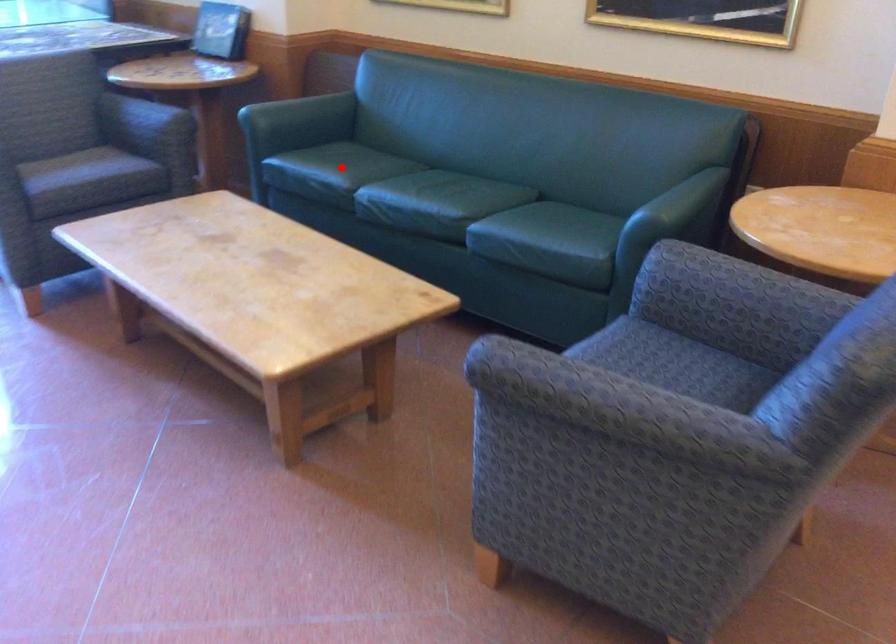
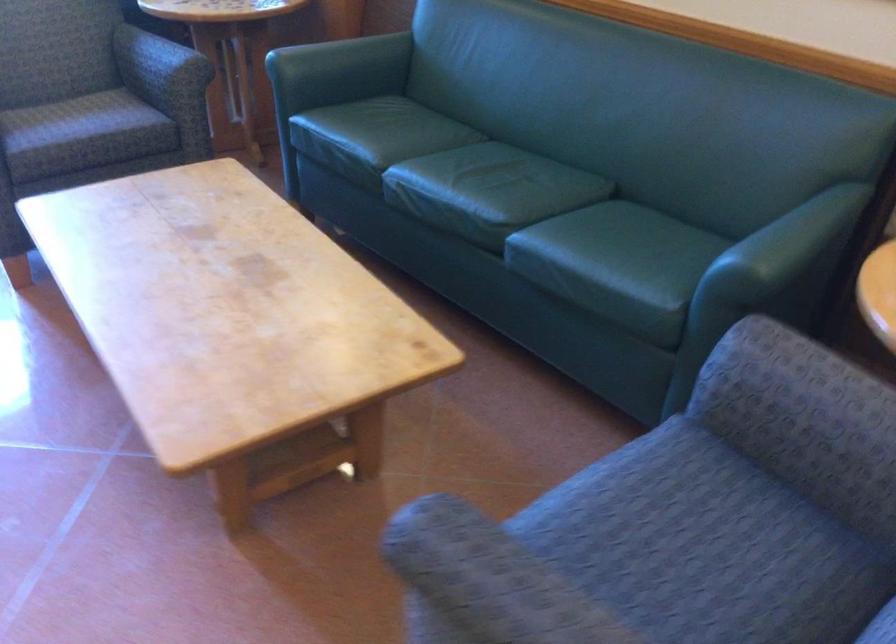
Question: A red point is marked in image1. In image2, is the corresponding 3D point closer to the camera or farther? Reply with the corresponding letter.

Choices:
 (A) The corresponding 3D point is closer.
 (B) The corresponding 3D point is farther.

Answer: (A)